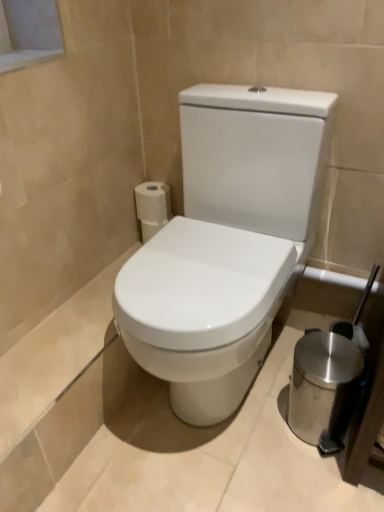
The height and width of the screenshot is (512, 384). I want to click on free space above polished stainless steel trash can at lower right (from a real-world perspective), so click(x=332, y=351).